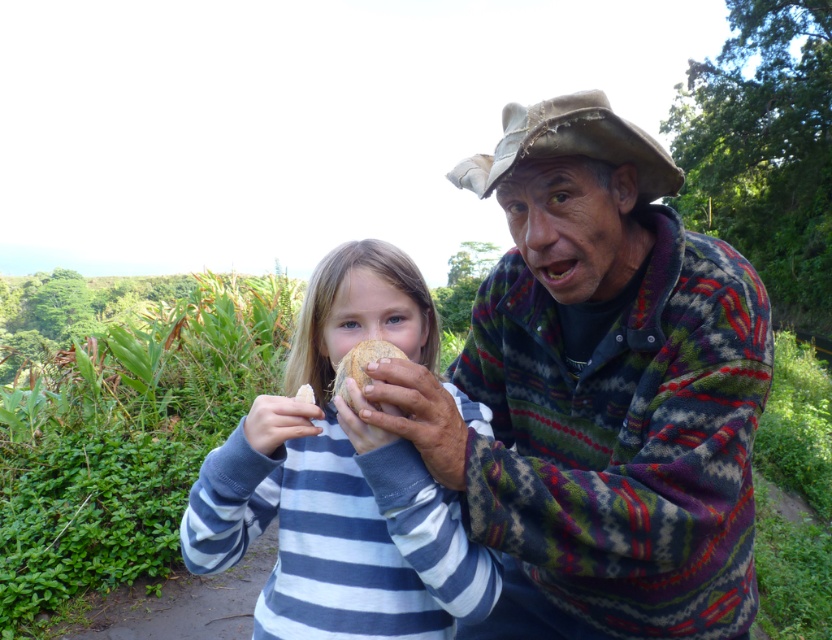
In the scene described, there is a multicolored knitted sweater at center and a brown matte coconut at center. From the perspective of someone standing in front of these objects, which object is positioned to the right?

The multicolored knitted sweater at center is to the right of the brown matte coconut at center.

You are a photographer trying to capture the brown matte coconut at center without the multicolored knitted sweater at center appearing in the shot. Can you adjust your camera angle to achieve this?

The multicolored knitted sweater at center is positioned under the brown matte coconut at center, so by angling the camera upwards, you can frame the shot to exclude the sweater while focusing on the coconut.

You are a tailor who needs to determine if a blue striped sweater at center can fit into a storage box designed for items smaller than the brown matte coconut at center. Based on the scene, can the sweater be placed in the box?

The blue striped sweater at center is bigger than the brown matte coconut at center, so it cannot fit into the storage box designed for items smaller than the brown matte coconut at center.